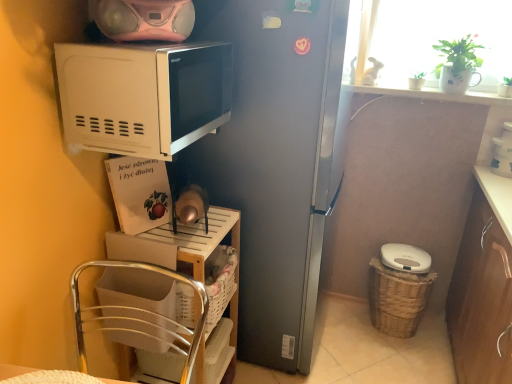
Question: Considering the relative sizes of white matte microwave at upper left and white plastic trash can at lower right, the first appliance in the bottom-to-top sequence, in the image provided, is white matte microwave at upper left shorter than white plastic trash can at lower right, the first appliance in the bottom-to-top sequence,?

Choices:
 (A) yes
 (B) no

Answer: (B)

Question: Could you tell me if white matte microwave at upper left is facing white plastic trash can at lower right, which ranks as the 1th appliance in back-to-front order?

Choices:
 (A) yes
 (B) no

Answer: (B)

Question: From a real-world perspective, is white matte microwave at upper left on top of white plastic trash can at lower right, the first appliance in the bottom-to-top sequence?

Choices:
 (A) no
 (B) yes

Answer: (B)

Question: Does white matte microwave at upper left have a smaller size compared to white plastic trash can at lower right, which appears as the 2th appliance when viewed from the left?

Choices:
 (A) no
 (B) yes

Answer: (A)

Question: Is white plastic trash can at lower right, which is the second appliance in right-to-left order, at the back of white matte microwave at upper left?

Choices:
 (A) yes
 (B) no

Answer: (B)

Question: From a real-world perspective, is brown wood cabinet at lower right above or below metallic silver chair at lower left?

Choices:
 (A) above
 (B) below

Answer: (B)

Question: Considering the positions of brown wood cabinet at lower right and metallic silver chair at lower left in the image, is brown wood cabinet at lower right bigger or smaller than metallic silver chair at lower left?

Choices:
 (A) big
 (B) small

Answer: (A)

Question: In the image, is brown wood cabinet at lower right positioned in front of or behind metallic silver chair at lower left?

Choices:
 (A) front
 (B) behind

Answer: (B)

Question: Is brown wood cabinet at lower right inside the boundaries of metallic silver chair at lower left, or outside?

Choices:
 (A) inside
 (B) outside

Answer: (B)

Question: Based on their sizes in the image, would you say white glossy coffee maker at upper right, which appears as the 2th appliance when viewed from the front, is bigger or smaller than white plastic shelf at lower left?

Choices:
 (A) big
 (B) small

Answer: (B)

Question: From the image's perspective, is white glossy coffee maker at upper right, the second appliance in the back-to-front sequence, above or below white plastic shelf at lower left?

Choices:
 (A) below
 (B) above

Answer: (B)

Question: Which is correct: white glossy coffee maker at upper right, which appears as the 2th appliance when viewed from the front, is inside white plastic shelf at lower left, or outside of it?

Choices:
 (A) outside
 (B) inside

Answer: (A)

Question: In the image, is white glossy coffee maker at upper right, the second appliance in the back-to-front sequence, positioned in front of or behind white plastic shelf at lower left?

Choices:
 (A) behind
 (B) front

Answer: (A)

Question: From the image's perspective, is pink matte speaker at upper center, acting as the 3th appliance starting from the back, above or below white glossy coffee maker at upper right, the second appliance in the back-to-front sequence?

Choices:
 (A) below
 (B) above

Answer: (B)

Question: In terms of width, does pink matte speaker at upper center, the 3th appliance from the right, look wider or thinner when compared to white glossy coffee maker at upper right, which is counted as the second appliance, starting from the top?

Choices:
 (A) wide
 (B) thin

Answer: (A)